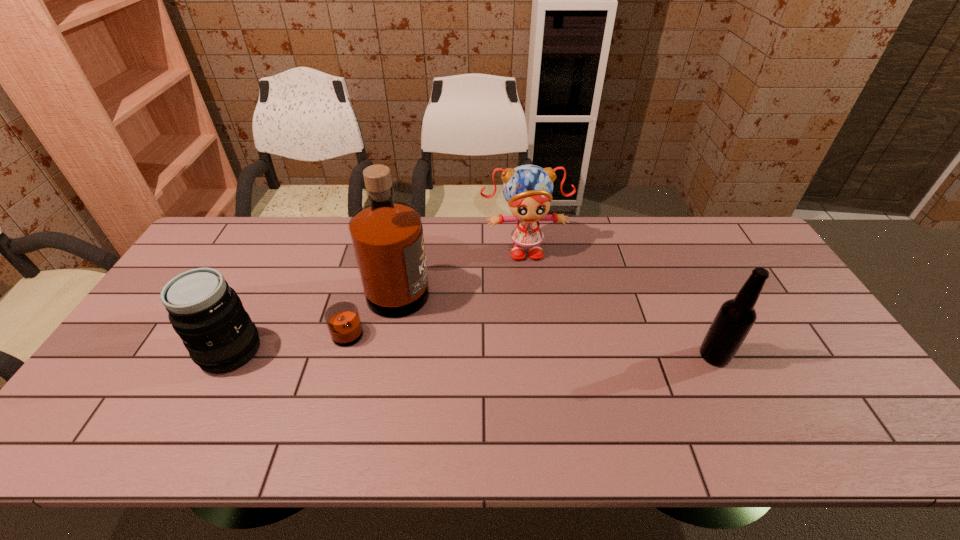
This screenshot has height=540, width=960. Identify the location of free space between the farthest object and the rightmost object. (619, 302).

Select which object is the second closest to the doll. Please provide its 2D coordinates. Your answer should be formatted as a tuple, i.e. [(x, y)], where the tuple contains the x and y coordinates of a point satisfying the conditions above.

[(734, 320)]

Where is `object that ranks as the closest to the shortest object`? This screenshot has width=960, height=540. object that ranks as the closest to the shortest object is located at coordinates tap(387, 237).

Where is `free space that satisfies the following two spatial constraints: 1. on the back side of the third object from left to right; 2. on the right side of the tallest object`? The image size is (960, 540). free space that satisfies the following two spatial constraints: 1. on the back side of the third object from left to right; 2. on the right side of the tallest object is located at coordinates point(397,247).

Image resolution: width=960 pixels, height=540 pixels. Identify the location of free spot that satisfies the following two spatial constraints: 1. on the front side of the rightmost object; 2. on the left side of the liquor. (373, 356).

I want to click on free space that satisfies the following two spatial constraints: 1. on the front side of the third object from right to left; 2. on the right side of the beer bottle, so click(373, 356).

Where is `vacant area that satisfies the following two spatial constraints: 1. on the front side of the rightmost object; 2. on the left side of the telephoto lens`? vacant area that satisfies the following two spatial constraints: 1. on the front side of the rightmost object; 2. on the left side of the telephoto lens is located at coordinates (228, 356).